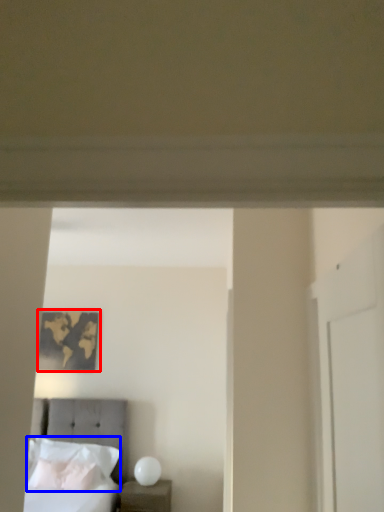
Question: Which object appears farthest to the camera in this image, picture frame (highlighted by a red box) or pillow (highlighted by a blue box)?

Choices:
 (A) picture frame
 (B) pillow

Answer: (A)